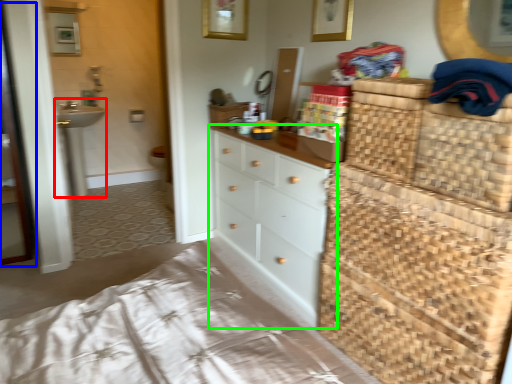
Question: Based on their relative distances, which object is nearer to sink (highlighted by a red box)? Choose from screen door (highlighted by a blue box) and chest of drawers (highlighted by a green box).

Choices:
 (A) screen door
 (B) chest of drawers

Answer: (A)